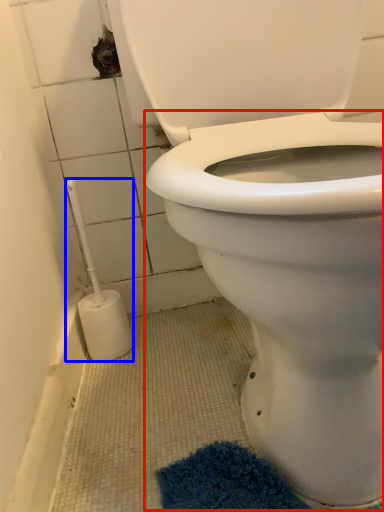
Question: Among these objects, which one is farthest to the camera, bidet (highlighted by a red box) or brush (highlighted by a blue box)?

Choices:
 (A) bidet
 (B) brush

Answer: (B)